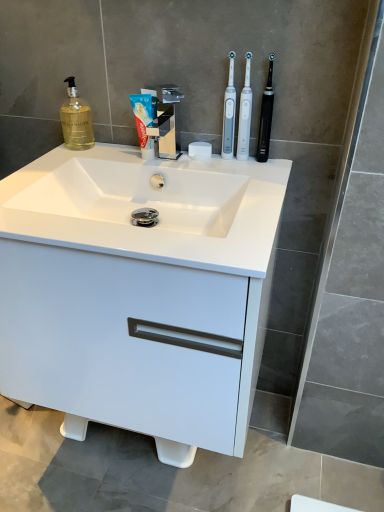
Question: Are white glossy toothpaste at center and translucent glass soap dispenser at upper left making contact?

Choices:
 (A) no
 (B) yes

Answer: (A)

Question: Is white glossy toothpaste at center to the left of translucent glass soap dispenser at upper left from the viewer's perspective?

Choices:
 (A) yes
 (B) no

Answer: (B)

Question: From a real-world perspective, is white glossy toothpaste at center positioned over translucent glass soap dispenser at upper left based on gravity?

Choices:
 (A) no
 (B) yes

Answer: (A)

Question: Is white glossy toothpaste at center far away from translucent glass soap dispenser at upper left?

Choices:
 (A) no
 (B) yes

Answer: (A)

Question: Is white glossy toothpaste at center surrounding translucent glass soap dispenser at upper left?

Choices:
 (A) no
 (B) yes

Answer: (A)

Question: Is white glossy toothpaste at center in front of translucent glass soap dispenser at upper left?

Choices:
 (A) yes
 (B) no

Answer: (A)

Question: Can white glossy cabinet at center be found inside white matte soap at center?

Choices:
 (A) no
 (B) yes

Answer: (A)

Question: From the image's perspective, does white matte soap at center appear higher than white glossy cabinet at center?

Choices:
 (A) yes
 (B) no

Answer: (A)

Question: From the image's perspective, is white matte soap at center under white glossy cabinet at center?

Choices:
 (A) no
 (B) yes

Answer: (A)

Question: Does white matte soap at center lie in front of white glossy cabinet at center?

Choices:
 (A) yes
 (B) no

Answer: (B)

Question: Is white matte soap at center outside white glossy cabinet at center?

Choices:
 (A) yes
 (B) no

Answer: (A)

Question: Is white matte soap at center thinner than white glossy cabinet at center?

Choices:
 (A) no
 (B) yes

Answer: (B)

Question: Could you tell me if white plastic toothbrush at upper right, arranged as the third toothbrush when viewed from the right, is turned towards translucent glass soap dispenser at upper left?

Choices:
 (A) yes
 (B) no

Answer: (B)